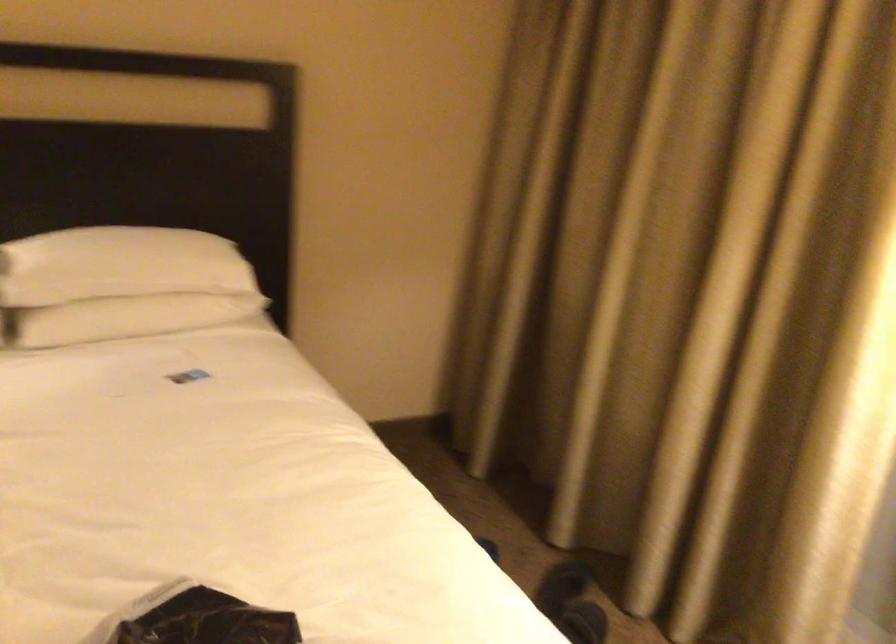
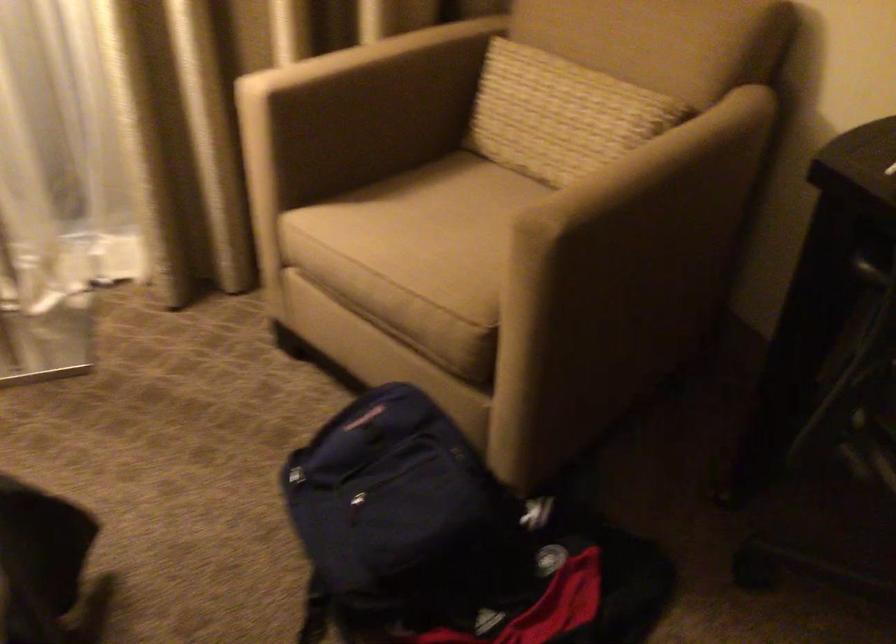
First-person continuous shooting, in which direction is the camera rotating?

The camera's rotation is toward right-down.